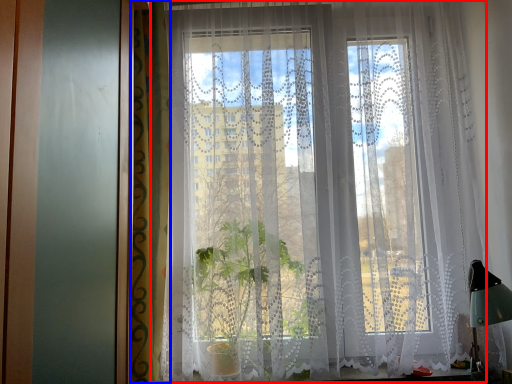
Question: Among these objects, which one is nearest to the camera, curtain (highlighted by a red box) or curtain (highlighted by a blue box)?

Choices:
 (A) curtain
 (B) curtain

Answer: (B)